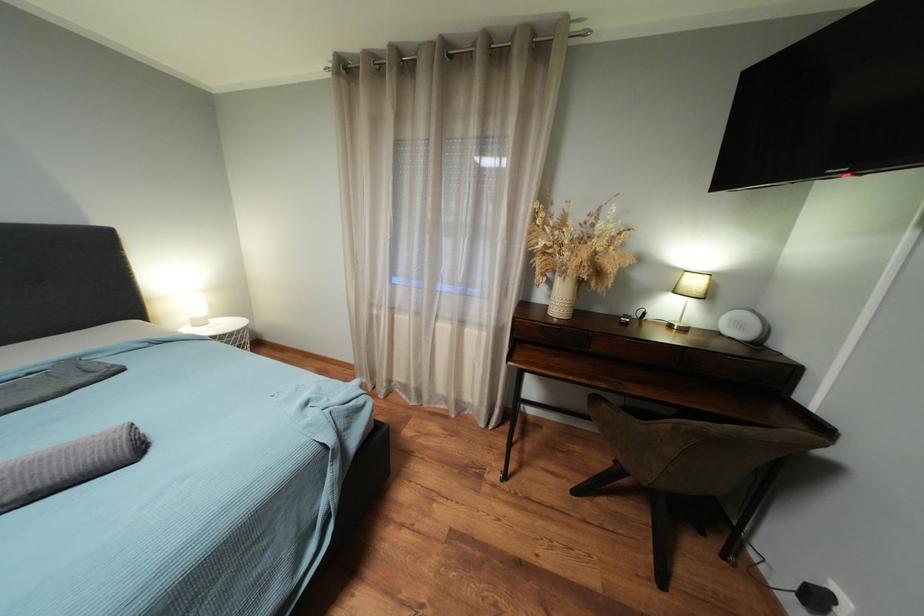
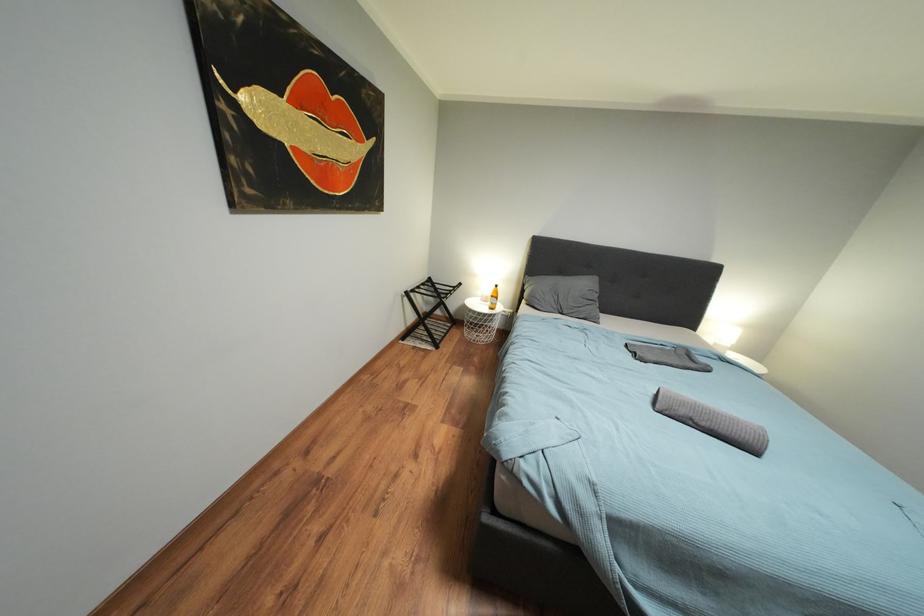
How did the camera likely rotate?

The camera's rotation is toward left-down.